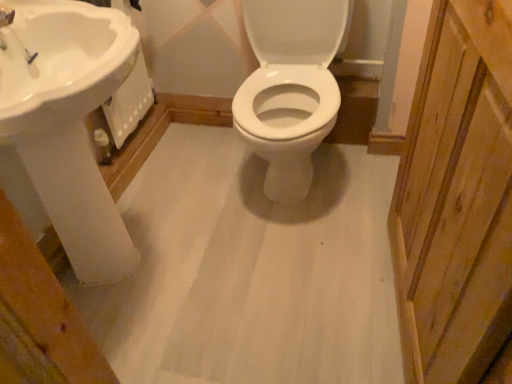
Question: From a real-world perspective, is natural wood screen door at right below white glossy sink at upper left?

Choices:
 (A) no
 (B) yes

Answer: (A)

Question: Is natural wood screen door at right placed right next to white glossy sink at upper left?

Choices:
 (A) no
 (B) yes

Answer: (A)

Question: Is natural wood screen door at right bigger than white glossy sink at upper left?

Choices:
 (A) yes
 (B) no

Answer: (B)

Question: Is natural wood screen door at right facing towards white glossy sink at upper left?

Choices:
 (A) yes
 (B) no

Answer: (A)

Question: Is natural wood screen door at right at the right side of white glossy sink at upper left?

Choices:
 (A) yes
 (B) no

Answer: (A)

Question: Is natural wood screen door at right thinner than white glossy sink at upper left?

Choices:
 (A) no
 (B) yes

Answer: (B)

Question: Is white glossy sink at upper left surrounding natural wood screen door at right?

Choices:
 (A) no
 (B) yes

Answer: (A)

Question: Can you confirm if white glossy sink at upper left is shorter than natural wood screen door at right?

Choices:
 (A) yes
 (B) no

Answer: (A)

Question: Is white glossy sink at upper left positioned behind natural wood screen door at right?

Choices:
 (A) no
 (B) yes

Answer: (B)

Question: Are white glossy sink at upper left and natural wood screen door at right far apart?

Choices:
 (A) no
 (B) yes

Answer: (A)

Question: From the image's perspective, is white glossy sink at upper left above natural wood screen door at right?

Choices:
 (A) yes
 (B) no

Answer: (A)

Question: Does white glossy sink at upper left appear on the right side of natural wood screen door at right?

Choices:
 (A) yes
 (B) no

Answer: (B)

Question: From the image's perspective, is natural wood screen door at right positioned above or below white glossy sink at upper left?

Choices:
 (A) above
 (B) below

Answer: (B)